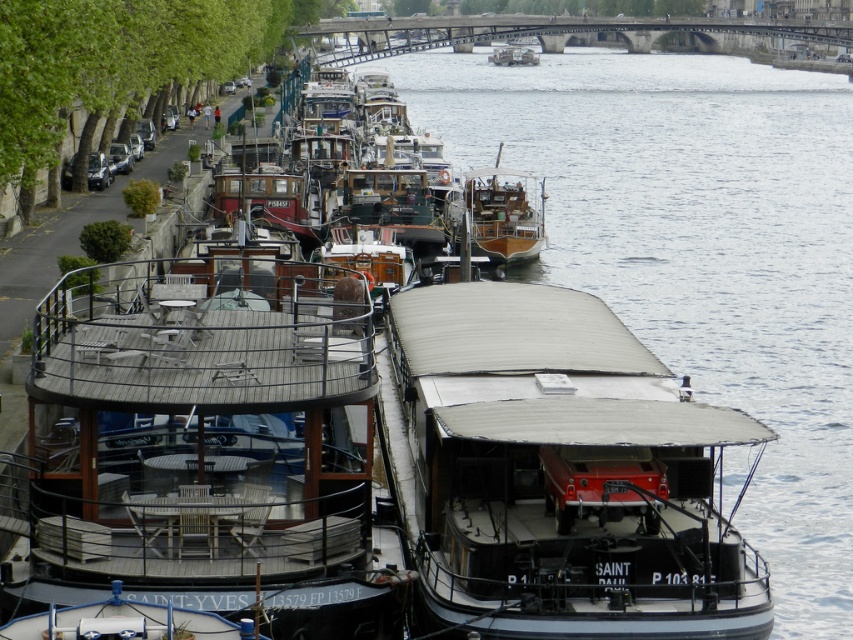
Question: Which object is closer to the camera taking this photo?

Choices:
 (A) wooden boat at center
 (B) smooth gray water at center
 (C) black matte boat at center
 (D) wooden deck boat at center

Answer: (D)

Question: Can you confirm if smooth gray water at center is positioned to the right of wooden boat at center?

Choices:
 (A) yes
 (B) no

Answer: (A)

Question: Does wooden deck boat at center have a lesser width compared to wooden boat at center?

Choices:
 (A) yes
 (B) no

Answer: (B)

Question: Among these points, which one is nearest to the camera?

Choices:
 (A) tap(640, 188)
 (B) tap(325, 524)

Answer: (B)

Question: Which point is closer to the camera taking this photo?

Choices:
 (A) (521, 244)
 (B) (231, 388)
 (C) (553, 420)
 (D) (786, 476)

Answer: (B)

Question: Does wooden deck boat at center have a greater width compared to wooden boat at center?

Choices:
 (A) yes
 (B) no

Answer: (A)